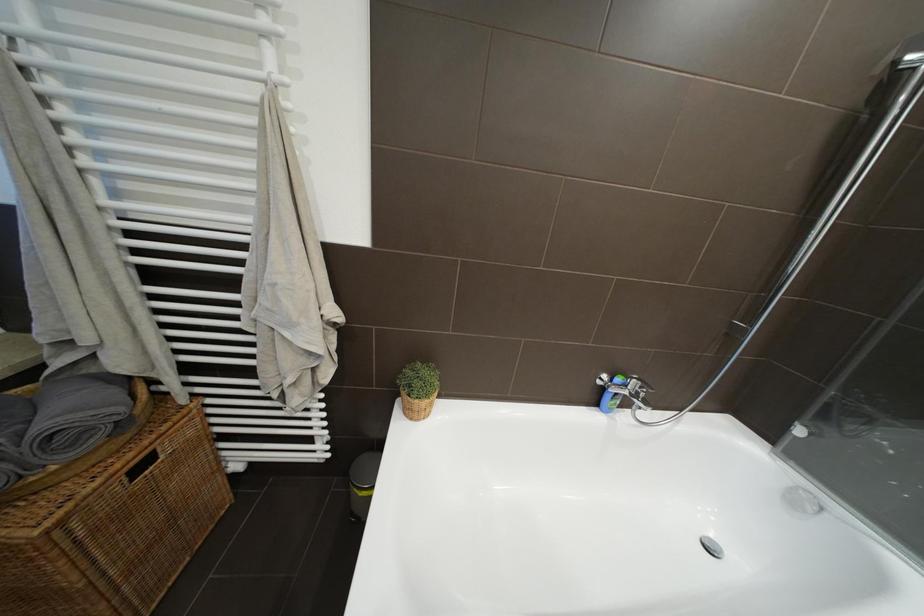
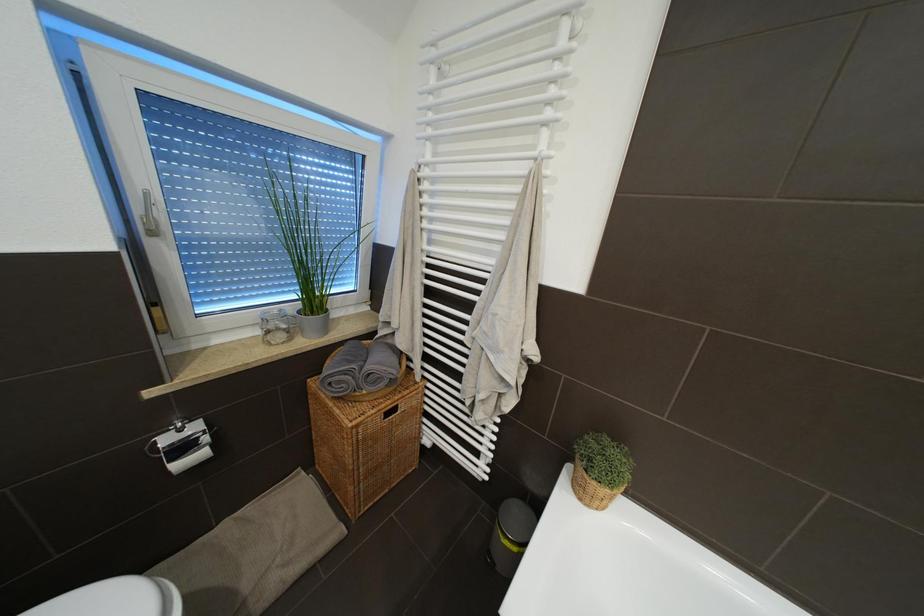
Question: The first image is from the beginning of the video and the second image is from the end. How did the camera likely rotate when shooting the video?

Choices:
 (A) Left
 (B) Right
 (C) Up
 (D) Down

Answer: (A)